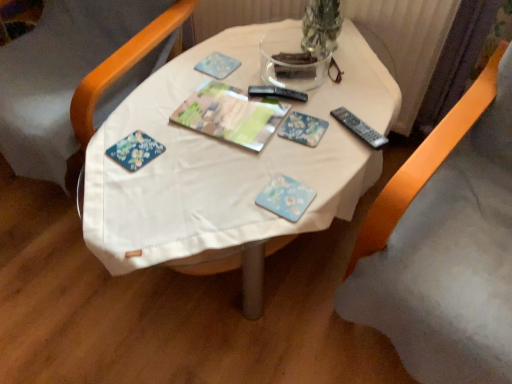
Where is `vacant space to the right of floral-patterned paper at center, placed as the 2th paperback book when sorted from bottom to top`? Image resolution: width=512 pixels, height=384 pixels. vacant space to the right of floral-patterned paper at center, placed as the 2th paperback book when sorted from bottom to top is located at coordinates (358, 120).